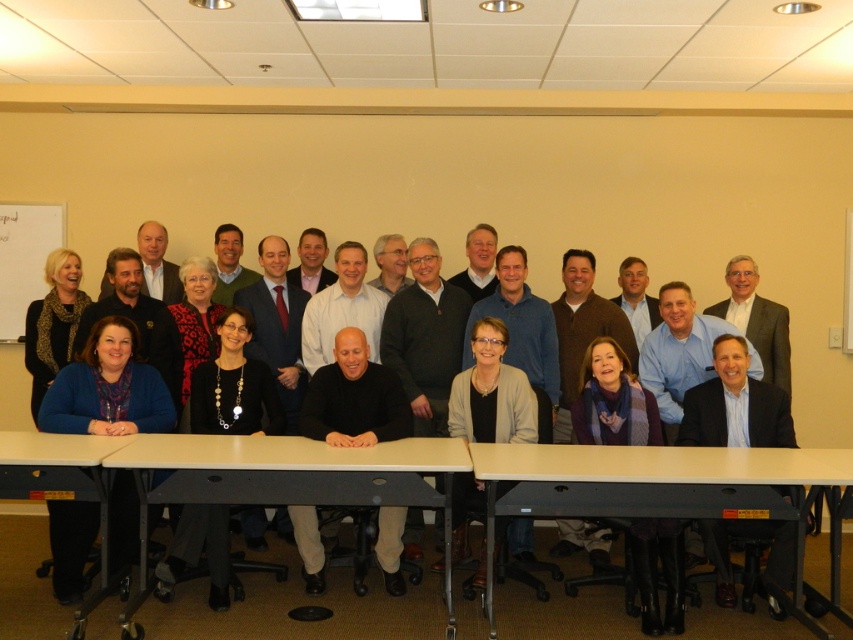
Question: Among these objects, which one is nearest to the camera?

Choices:
 (A) white plastic table at center
 (B) black sweater at center
 (C) light brown wood table at lower left
 (D) whiteboard at upper left

Answer: (A)

Question: In this image, where is white plastic table at center located relative to light brown wood table at lower left?

Choices:
 (A) below
 (B) above

Answer: (A)

Question: Among these points, which one is nearest to the camera?

Choices:
 (A) (550, 310)
 (B) (70, 452)
 (C) (119, 451)
 (D) (639, 483)

Answer: (D)

Question: Which point appears farthest from the camera in this image?

Choices:
 (A) (549, 365)
 (B) (73, 436)
 (C) (15, 337)
 (D) (370, 484)

Answer: (C)

Question: Can you confirm if white plastic table at center is bigger than black sweater at center?

Choices:
 (A) no
 (B) yes

Answer: (A)

Question: Is white plastic table at center smaller than whiteboard at upper left?

Choices:
 (A) no
 (B) yes

Answer: (A)